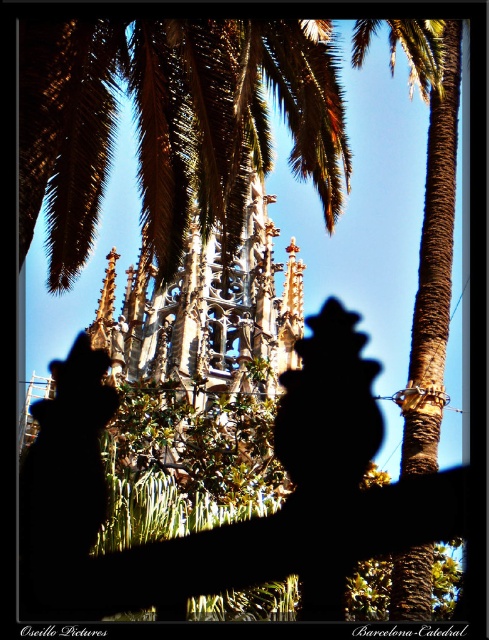
You are a bird flying over a park and see the green leafy palm at upper center and the brown rough palm tree at center. Which palm tree is closer to the left side of the park?

The green leafy palm at upper center is closer to the left side of the park because it is positioned to the left of the brown rough palm tree at center.

You are an architect planning to take a photo of the brown rough palm tree at center and the green leafy palm at upper center. Which palm tree will appear larger in your photo?

The green leafy palm at upper center will appear larger because it is closer to the viewer than the brown rough palm tree at center.

You are standing in front of the cathedral and notice two points marked in the scene. The first point is at coordinates point (64, 36) and the second is at point (412, 404). Which point is nearer to your eyes?

Point (64, 36) is closer to the camera than point (412, 404), so the first point is nearer to your eyes.